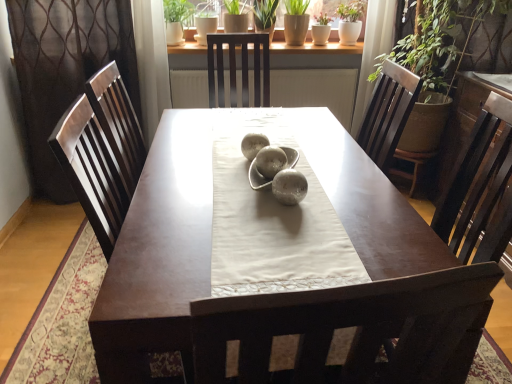
Question: Is green matte pot at upper center, which ranks as the 2th plant in right-to-left order, not within green matte plant at upper center, which is the third plant in left-to-right order?

Choices:
 (A) no
 (B) yes

Answer: (B)

Question: From the image's perspective, is green matte pot at upper center, which ranks as the 2th plant in right-to-left order, under green matte plant at upper center, which is the third plant in left-to-right order?

Choices:
 (A) yes
 (B) no

Answer: (B)

Question: Considering the relative sizes of green matte pot at upper center, marked as the 2th plant in a left-to-right arrangement, and green matte plant at upper center, which appears as the first plant when viewed from the right, in the image provided, is green matte pot at upper center, marked as the 2th plant in a left-to-right arrangement, wider than green matte plant at upper center, which appears as the first plant when viewed from the right,?

Choices:
 (A) yes
 (B) no

Answer: (B)

Question: From a real-world perspective, is green matte pot at upper center, marked as the 2th plant in a left-to-right arrangement, physically below green matte plant at upper center, which is the third plant in left-to-right order?

Choices:
 (A) no
 (B) yes

Answer: (A)

Question: Could you tell me if green matte pot at upper center, marked as the 2th plant in a left-to-right arrangement, is facing green matte plant at upper center, which is the third plant in left-to-right order?

Choices:
 (A) yes
 (B) no

Answer: (B)

Question: Is green matte pot at upper center, which ranks as the 2th plant in right-to-left order, surrounding green matte plant at upper center, which is the third plant in left-to-right order?

Choices:
 (A) no
 (B) yes

Answer: (A)

Question: Does brown textured curtain at left have a larger size compared to green matte plant at upper center, which appears as the first plant when viewed from the right?

Choices:
 (A) yes
 (B) no

Answer: (A)

Question: From the image's perspective, is brown textured curtain at left over green matte plant at upper center, which appears as the first plant when viewed from the right?

Choices:
 (A) no
 (B) yes

Answer: (A)

Question: From the image's perspective, is brown textured curtain at left below green matte plant at upper center, which appears as the first plant when viewed from the right?

Choices:
 (A) no
 (B) yes

Answer: (B)

Question: Are brown textured curtain at left and green matte plant at upper center, which is the third plant in left-to-right order, far apart?

Choices:
 (A) no
 (B) yes

Answer: (B)

Question: Is brown textured curtain at left not within green matte plant at upper center, which is the third plant in left-to-right order?

Choices:
 (A) no
 (B) yes

Answer: (B)

Question: From a real-world perspective, is brown textured curtain at left positioned under green matte plant at upper center, which is the third plant in left-to-right order, based on gravity?

Choices:
 (A) no
 (B) yes

Answer: (B)

Question: Does green matte plant at upper center, the first plant viewed from the left, appear on the right side of green matte plant at upper center, which appears as the first plant when viewed from the right?

Choices:
 (A) no
 (B) yes

Answer: (A)